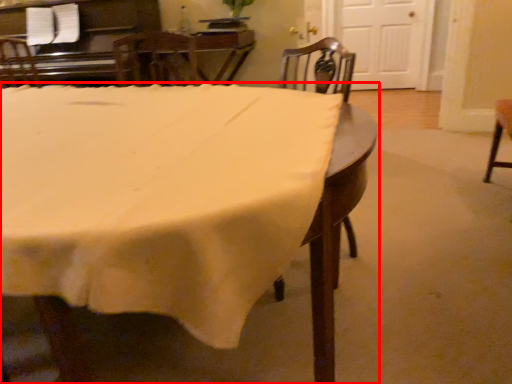
Question: In this image, where is table (annotated by the red box) located relative to chair?

Choices:
 (A) right
 (B) left

Answer: (B)